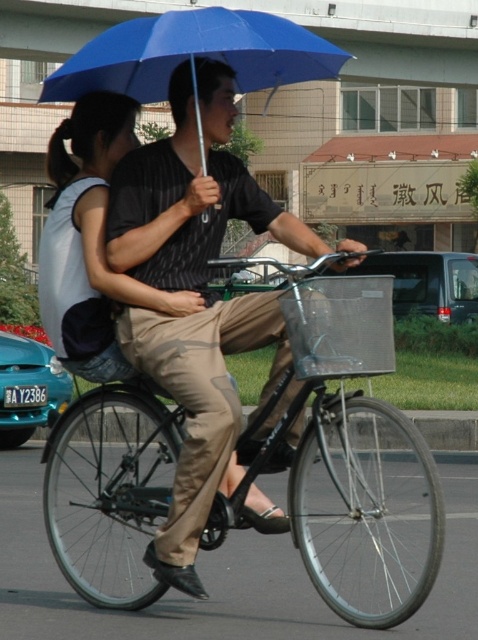
You are a pedestrian standing on the sidewalk and see the metallic silver bicycle at center and the matte black shirt at center in the image. Which object is closer to you?

The metallic silver bicycle at center is closer to you because it is positioned under the matte black shirt at center, meaning the bicycle is in front of the shirt.